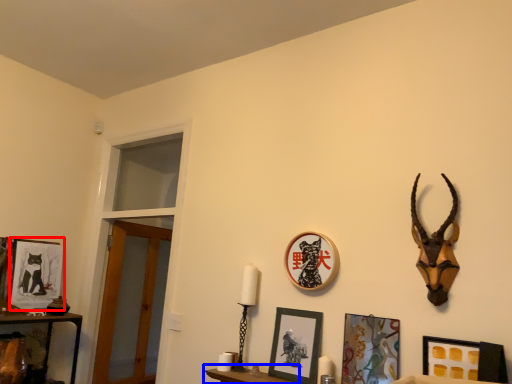
Question: Which object is further to the camera taking this photo, picture frame (highlighted by a red box) or furniture (highlighted by a blue box)?

Choices:
 (A) picture frame
 (B) furniture

Answer: (A)